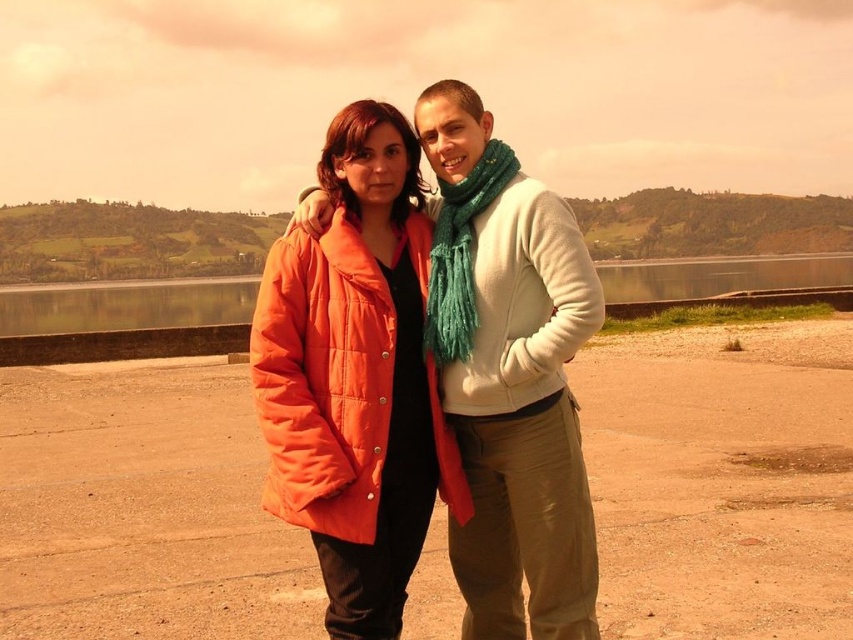
Question: Does orange puffy coat at center have a lesser width compared to transparent glass water at lower left?

Choices:
 (A) yes
 (B) no

Answer: (A)

Question: Which object is farther from the camera taking this photo?

Choices:
 (A) orange puffy coat at center
 (B) transparent glass water at lower left
 (C) quilted orange jacket at center

Answer: (B)

Question: Is orange puffy coat at center positioned in front of quilted orange jacket at center?

Choices:
 (A) no
 (B) yes

Answer: (B)

Question: Is orange puffy coat at center above transparent glass water at lower left?

Choices:
 (A) no
 (B) yes

Answer: (A)

Question: Which point is closer to the camera?

Choices:
 (A) transparent glass water at lower left
 (B) quilted orange jacket at center
 (C) orange puffy coat at center

Answer: (C)

Question: Which of the following is the farthest from the observer?

Choices:
 (A) (422, 305)
 (B) (112, 321)
 (C) (426, 339)

Answer: (B)